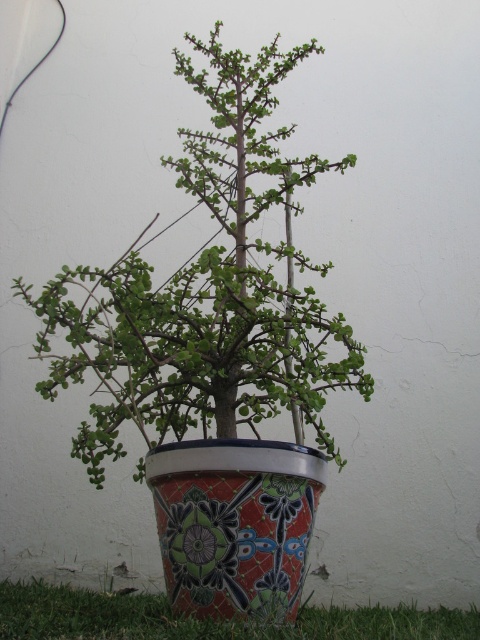
You are a gardener inspecting the outdoor area. You see the green glossy plant at center and the matte ceramic pot at center. Which object is positioned higher in the image?

The green glossy plant at center is located above the matte ceramic pot at center, so it is positioned higher in the image.

You are standing in front of the potted plant. Which object is positioned to the right side of the other between the green glossy plant at center and the matte ceramic pot at center?

The green glossy plant at center is to the left of the matte ceramic pot at center, so the matte ceramic pot at center is positioned to the right of the green glossy plant at center.

You are a gardener who needs to determine the spatial relationship between the green glossy plant at center and the matte ceramic pot at center. Which object occupies more space in the image?

The green glossy plant at center has a larger size compared to the matte ceramic pot at center, so it occupies more space in the image.